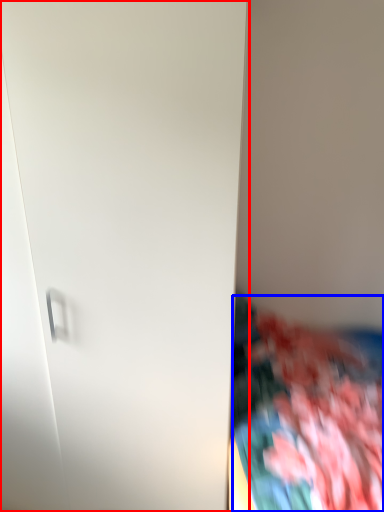
Question: Which of the following is the closest to the observer, door (highlighted by a red box) or textile (highlighted by a blue box)?

Choices:
 (A) door
 (B) textile

Answer: (B)